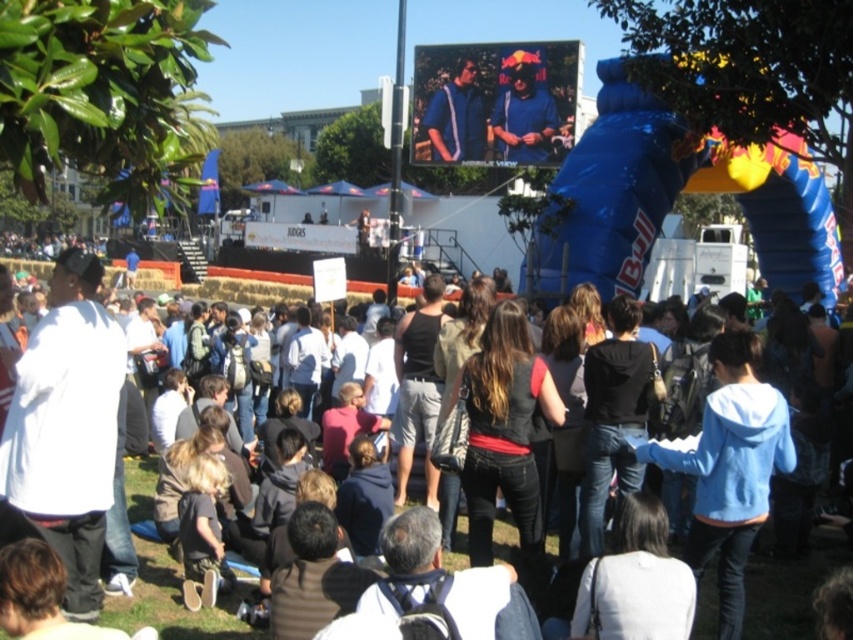
You are an event organizer checking the seating arrangement. You notice two jackets left behind by participants. The matte blue jacket at center and the blue fabric jacket at upper center. Which jacket is more likely to be a winter coat based on their thickness?

The blue fabric jacket at upper center is thicker than the matte blue jacket at center, so it is more likely to be a winter coat.

You are a photographer at the event and need to capture both the matte blue jacket at center and the blue fabric jacket at upper center in a single frame. Which jacket will appear smaller in the photo?

The matte blue jacket at center will appear smaller in the photo because it occupies less space than the blue fabric jacket at upper center.

You are a photographer at the event and want to capture a photo of the dark blue jeans at center and the blue fabric jacket at upper center. Which object should you focus on first if you want to ensure both are in the frame without moving the camera?

The dark blue jeans at center is positioned under the blue fabric jacket at upper center, so you should focus on the blue fabric jacket at upper center first to ensure both are in the frame without moving the camera.